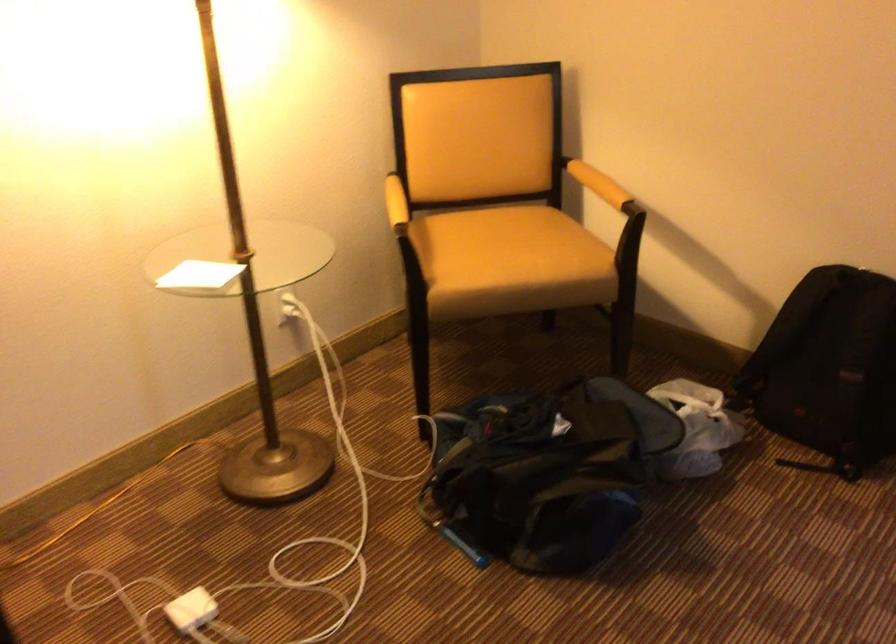
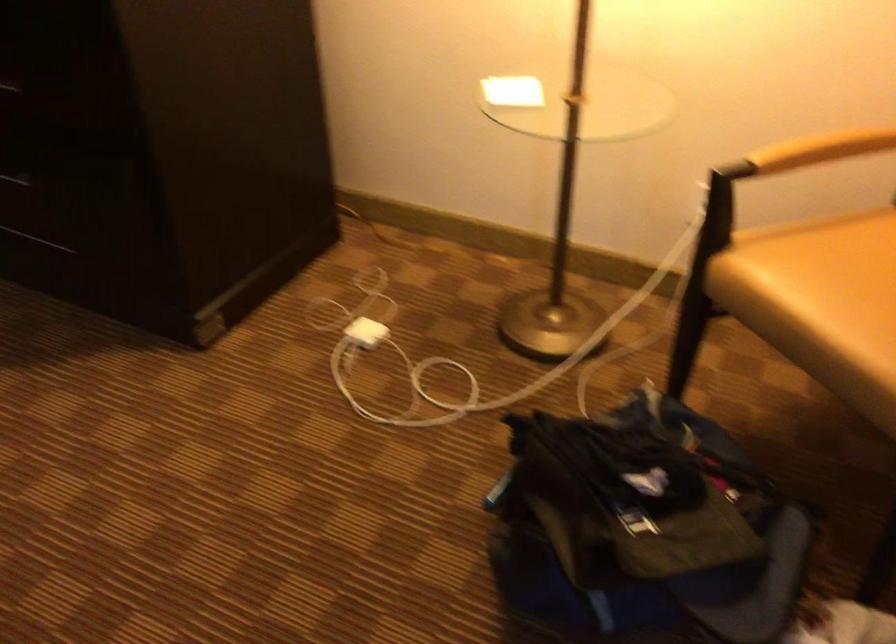
Locate, in the second image, the point that corresponds to the point at 519,270 in the first image.

(821, 303)